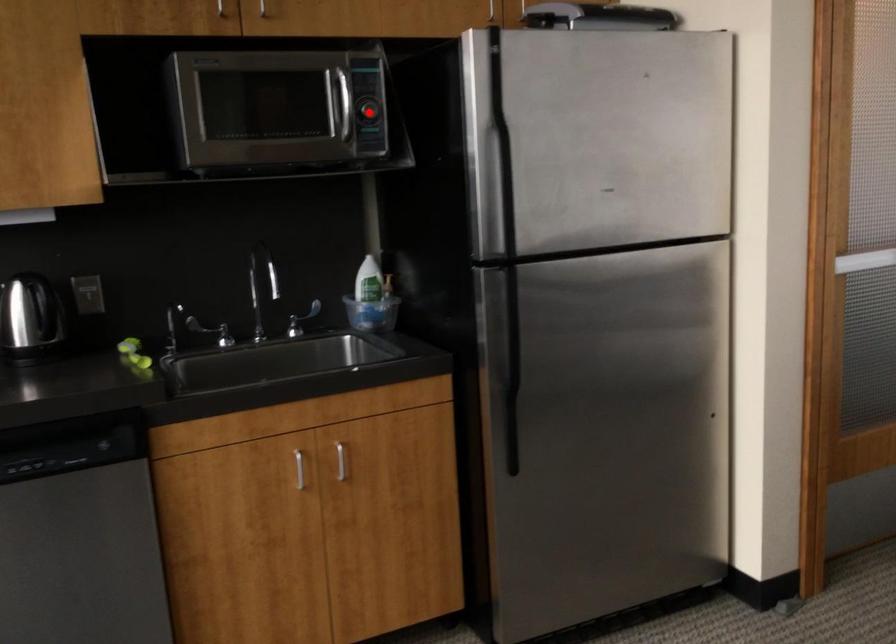
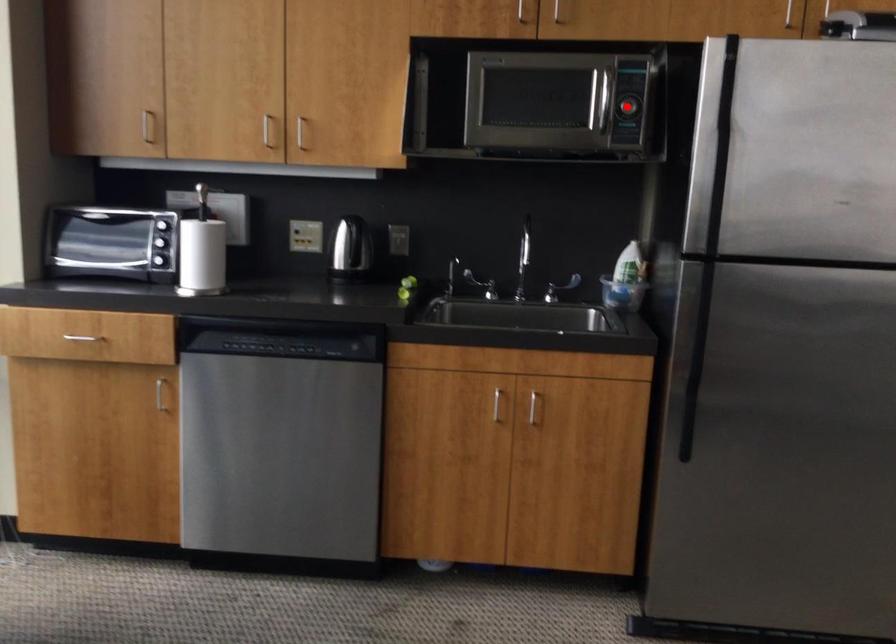
I am providing you with two images of the same scene from different viewpoints. A red point is marked on the first image and another point is marked on the second image. Do the highlighted points in image1 and image2 indicate the same real-world spot?

Yes